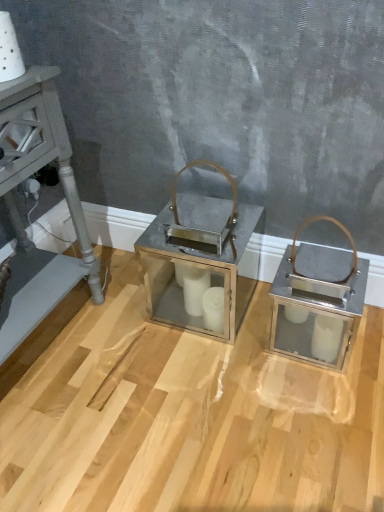
In order to click on vacant area situated to the left side of metallic silver lantern at center in this screenshot , I will do `click(117, 316)`.